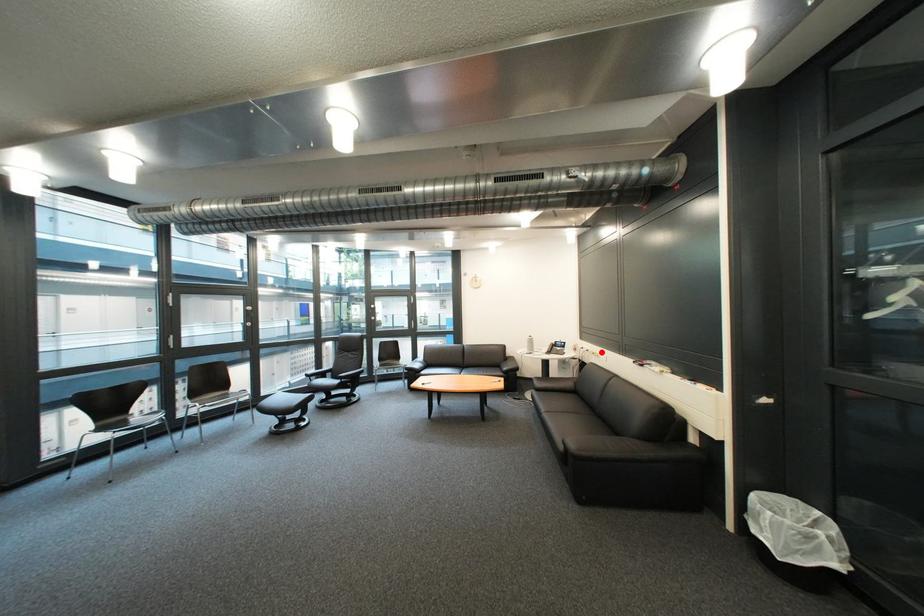
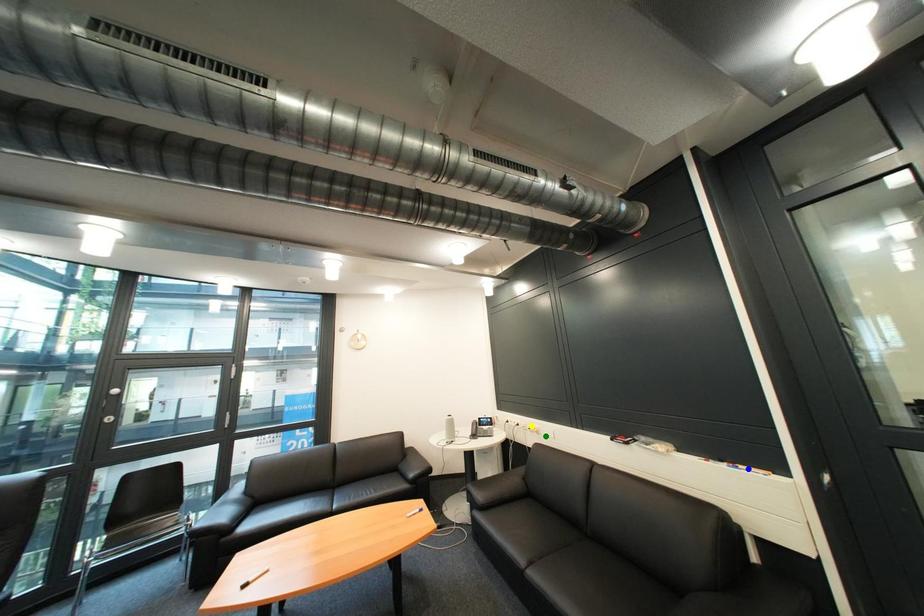
Question: I am providing you with two images of the same scene from different viewpoints. A red point is marked on the first image. You are given multiple points on the second image. Which point in image 2 represents the same 3d spot as the red point in image 1?

Choices:
 (A) blue point
 (B) green point
 (C) yellow point

Answer: (C)